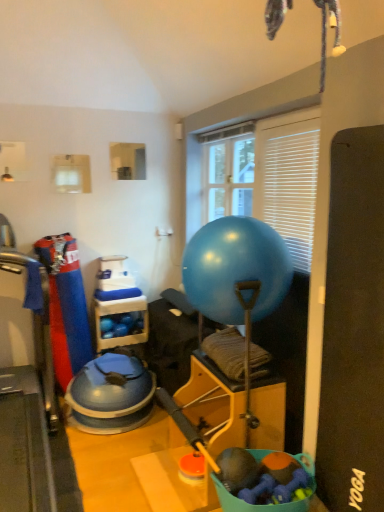
Question: Is blue rubber ball at center positioned with its back to rubberized fabric dog toy at lower center?

Choices:
 (A) no
 (B) yes

Answer: (A)

Question: Is the position of blue rubber ball at center less distant than that of rubberized fabric dog toy at lower center?

Choices:
 (A) yes
 (B) no

Answer: (B)

Question: Considering the relative sizes of blue rubber ball at center and rubberized fabric dog toy at lower center in the image provided, is blue rubber ball at center smaller than rubberized fabric dog toy at lower center?

Choices:
 (A) yes
 (B) no

Answer: (B)

Question: From the image's perspective, is blue rubber ball at center located beneath rubberized fabric dog toy at lower center?

Choices:
 (A) no
 (B) yes

Answer: (A)

Question: Is blue rubber ball at center at the right side of rubberized fabric dog toy at lower center?

Choices:
 (A) yes
 (B) no

Answer: (B)

Question: Could rubberized fabric dog toy at lower center be considered to be inside blue rubber ball at center?

Choices:
 (A) no
 (B) yes

Answer: (A)

Question: Would you say rubberized fabric dog toy at lower center is outside white blinds at upper right, which is the 2th window screen in back-to-front order?

Choices:
 (A) no
 (B) yes

Answer: (B)

Question: Is white blinds at upper right, which is counted as the 2th window screen, starting from the left, a part of rubberized fabric dog toy at lower center?

Choices:
 (A) yes
 (B) no

Answer: (B)

Question: Does rubberized fabric dog toy at lower center turn towards white blinds at upper right, which is counted as the 2th window screen, starting from the left?

Choices:
 (A) no
 (B) yes

Answer: (A)

Question: Is rubberized fabric dog toy at lower center behind white blinds at upper right, which is the 2th window screen in back-to-front order?

Choices:
 (A) yes
 (B) no

Answer: (B)

Question: From the image's perspective, is rubberized fabric dog toy at lower center above white blinds at upper right, which ranks as the 1th window screen in right-to-left order?

Choices:
 (A) no
 (B) yes

Answer: (A)

Question: Is rubberized fabric dog toy at lower center positioned with its back to white blinds at upper right, which is counted as the 2th window screen, starting from the left?

Choices:
 (A) yes
 (B) no

Answer: (B)

Question: From the image's perspective, does blue rubber mat at left appear higher than rubberized fabric dog toy at lower center?

Choices:
 (A) yes
 (B) no

Answer: (A)